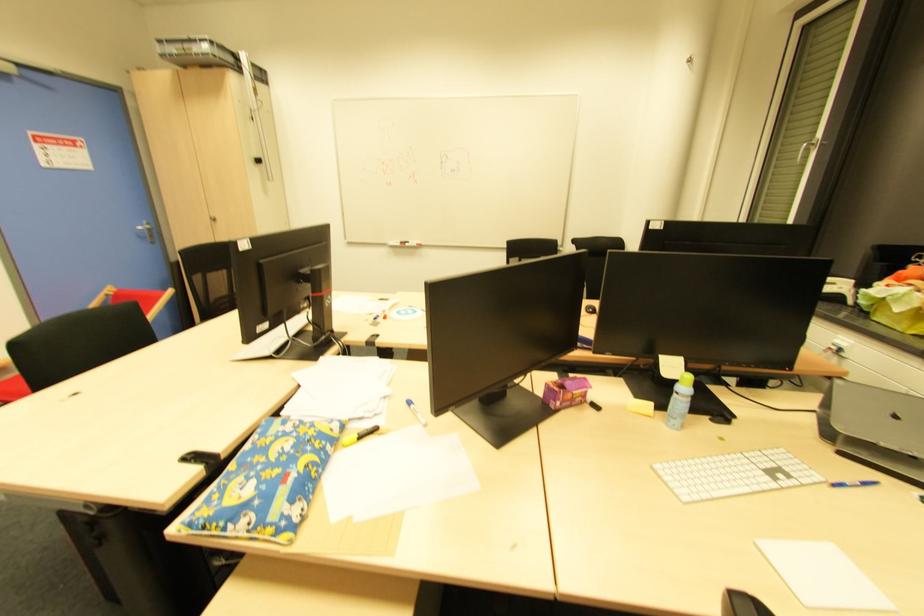
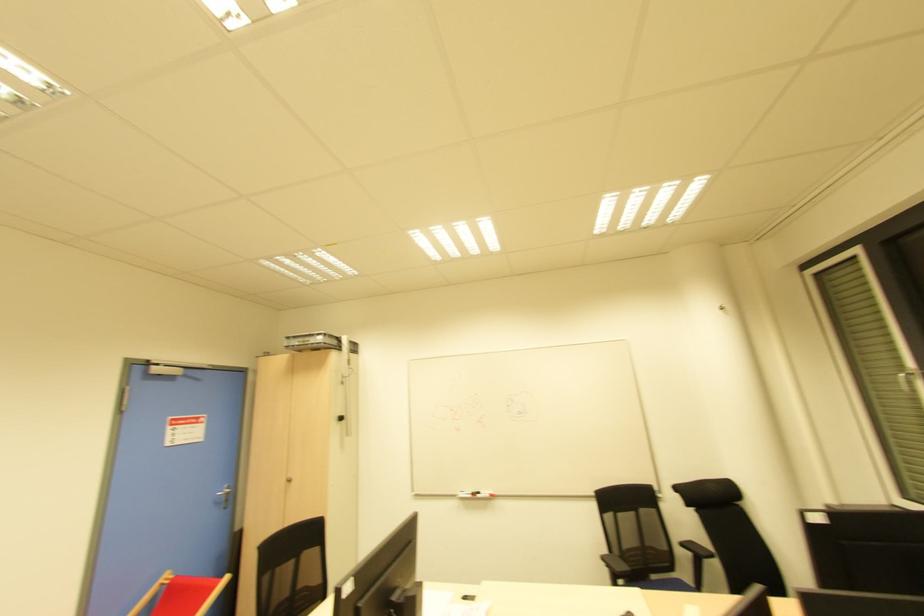
Locate, in the second image, the point that corresponds to [407,246] in the first image.

(478, 496)